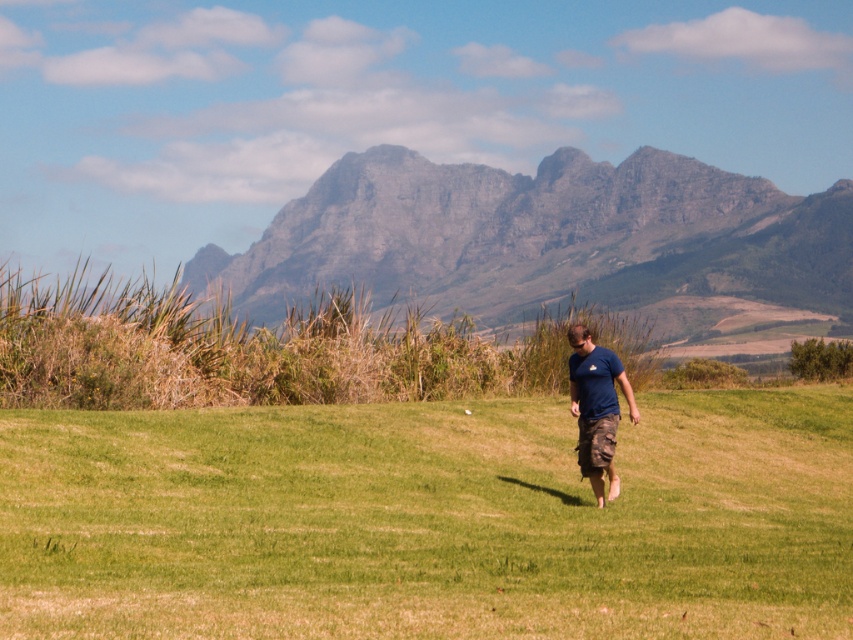
Can you confirm if gray rock mountain at center is wider than blue cotton t-shirt at center?

Indeed, gray rock mountain at center has a greater width compared to blue cotton t-shirt at center.

Is gray rock mountain at center closer to the viewer compared to blue cotton t-shirt at center?

That is False.

Does point (485, 209) come behind point (601, 422)?

Yes.

This screenshot has width=853, height=640. I want to click on gray rock mountain at center, so click(546, 236).

Which is more to the left, green grass at center or blue cotton t-shirt at center?

Positioned to the left is green grass at center.

Between point (844, 600) and point (619, 362), which one is positioned in front?

Positioned in front is point (844, 600).

Which is in front, point (480, 401) or point (601, 413)?

Point (601, 413) is more forward.

Locate an element on the screen. This screenshot has height=640, width=853. green grass at center is located at coordinates (428, 520).

Between green grass at center and gray rock mountain at center, which one appears on the right side from the viewer's perspective?

From the viewer's perspective, green grass at center appears more on the right side.

Is green grass at center below gray rock mountain at center?

Yes.

Between point (463, 442) and point (634, 218), which one is positioned behind?

Point (634, 218)

Where is `green grass at center`? green grass at center is located at coordinates (428, 520).